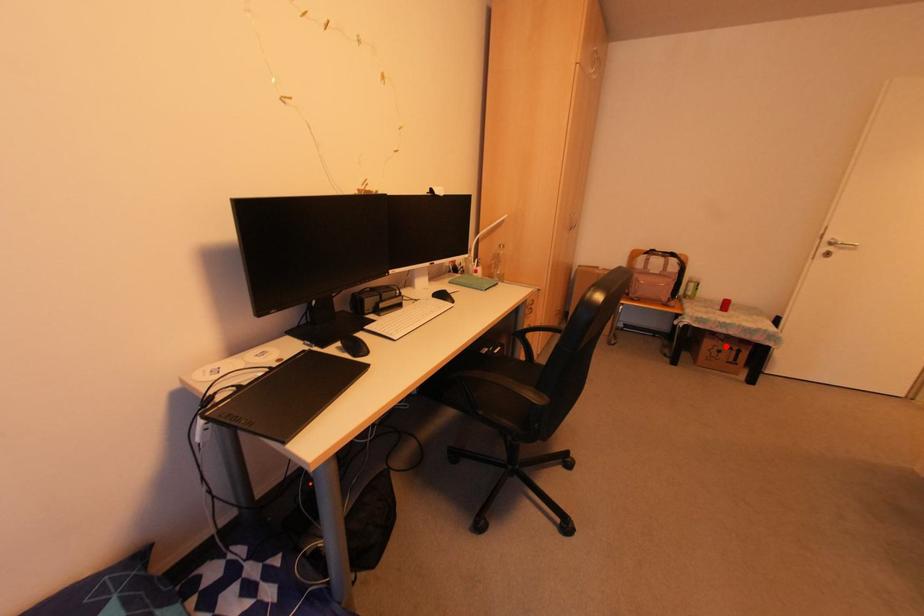
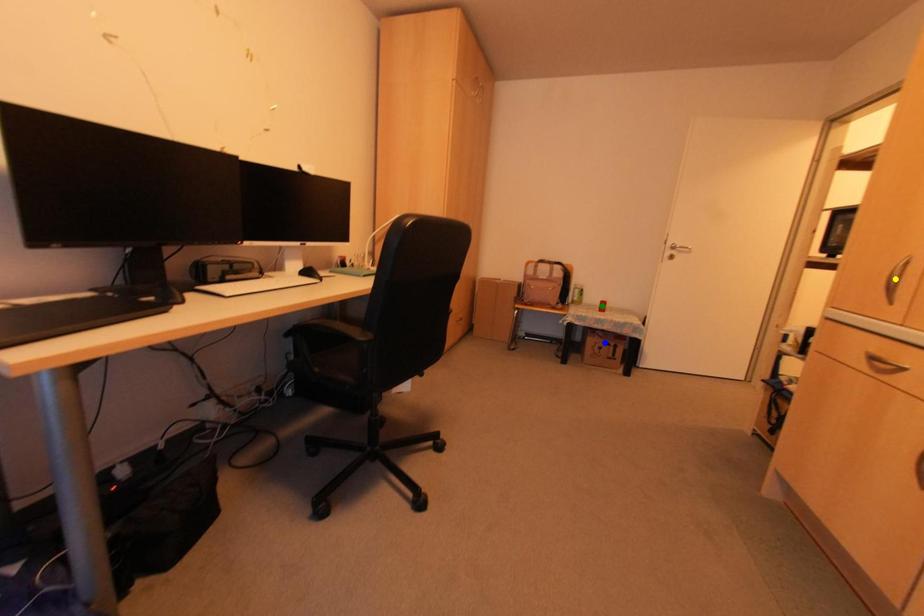
Question: I am providing you with two images of the same scene from different viewpoints. A red point is marked on the first image. You are given multiple points on the second image. Which mark in image 2 goes with the point in image 1?

Choices:
 (A) blue point
 (B) yellow point
 (C) green point

Answer: (A)